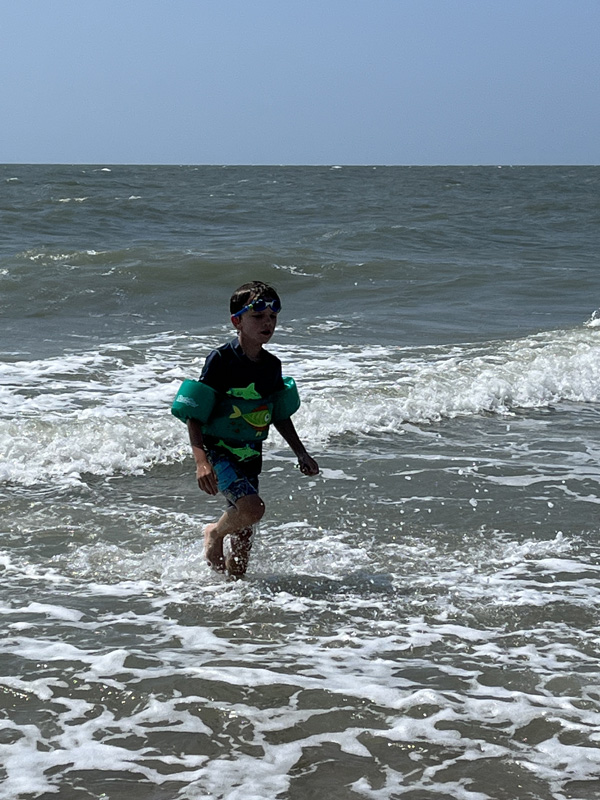
The image size is (600, 800). I want to click on foam, so click(x=118, y=446).